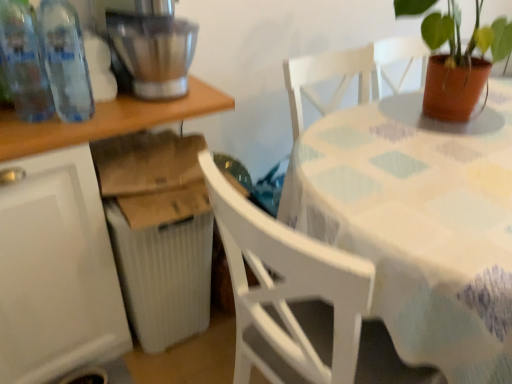
The height and width of the screenshot is (384, 512). I want to click on vacant region to the right of transparent plastic bottles at left, placed as the 1th bottle when sorted from left to right, so click(101, 117).